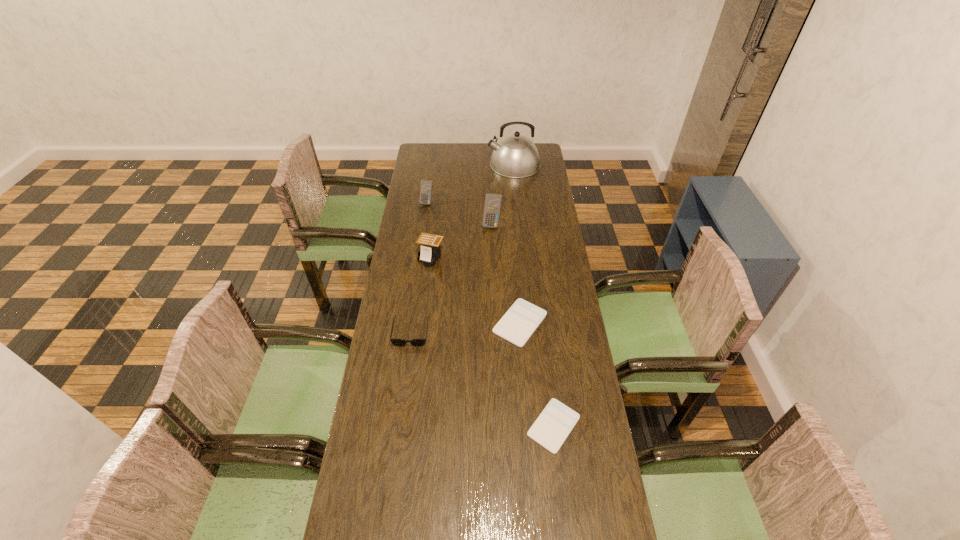
Identify the location of vacant area that lies between the second tallest calculator and the sunglasses. (419, 267).

At what (x,y) coordinates should I click in order to perform the action: click on vacant point located between the kettle and the smaller blue calculator. Please return your answer as a coordinate pair (x, y). The height and width of the screenshot is (540, 960). Looking at the image, I should click on (470, 183).

Identify the location of vacant area between the tallest object and the bigger white calculator. (517, 244).

What are the coordinates of `unoccupied area between the farther white calculator and the nearer blue calculator` in the screenshot? It's located at (506, 274).

Locate an element on the screen. This screenshot has width=960, height=540. free point between the smaller blue calculator and the third farthest calculator is located at coordinates (429, 230).

The image size is (960, 540). What are the coordinates of `free point between the fourth nearest calculator and the fourth nearest object` in the screenshot? It's located at (462, 241).

Locate an element on the screen. This screenshot has width=960, height=540. blank region between the farthest calculator and the tallest object is located at coordinates (470, 183).

What are the coordinates of `empty location between the sunglasses and the kettle` in the screenshot? It's located at click(x=463, y=248).

At what (x,y) coordinates should I click in order to perform the action: click on empty location between the kettle and the fifth tallest object. Please return your answer as a coordinate pair (x, y). The width and height of the screenshot is (960, 540). Looking at the image, I should click on (463, 248).

You are a GUI agent. You are given a task and a screenshot of the screen. Output one action in this format:
    pyautogui.click(x=<x>, y=<y>)
    Task: Click on the object identified as the fourth closest to the fifth tallest object
    The image size is (960, 540).
    Given the screenshot: What is the action you would take?
    pyautogui.click(x=492, y=205)